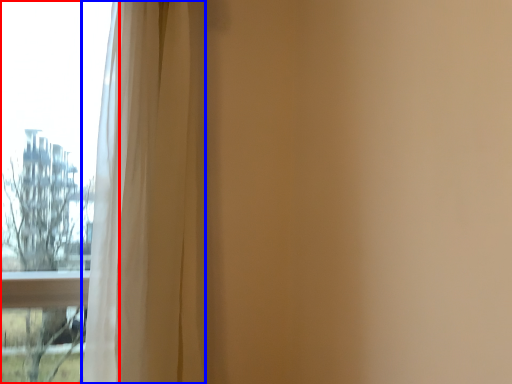
Question: Which point is further to the camera, window (highlighted by a red box) or curtain (highlighted by a blue box)?

Choices:
 (A) window
 (B) curtain

Answer: (A)